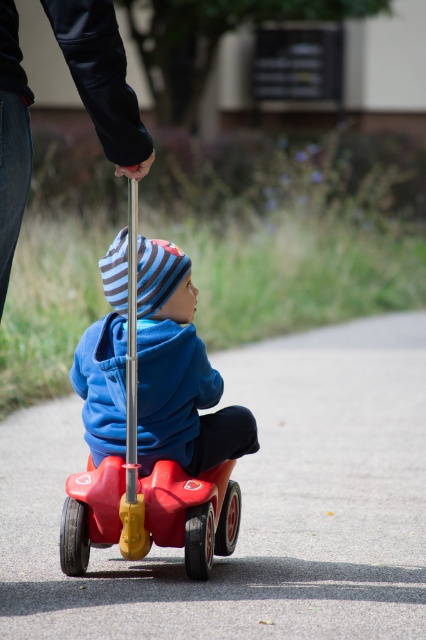
You are a photographer trying to capture a photo of the matte blue hoodie at center and the black leather jacket at upper left. To ensure both are in focus, you need to know their vertical positions. Which one is lower in the frame?

The matte blue hoodie at center is positioned under the black leather jacket at upper left, so the matte blue hoodie at center is lower in the frame.

You are a parent trying to ensure the safety of your child while they ride the rubberized plastic toy car at center. The black leather jacket at upper left belongs to another adult nearby. How far apart are these two objects from each other?

The black leather jacket at upper left is 1.52 meters from the rubberized plastic toy car at center.

You are standing in front of the tricycle and want to place a sticker on the closest point to you between point (97, 362) and point (117, 531). Which point should you choose?

You should choose point (97, 362) because it is closer to the viewer than point (117, 531).